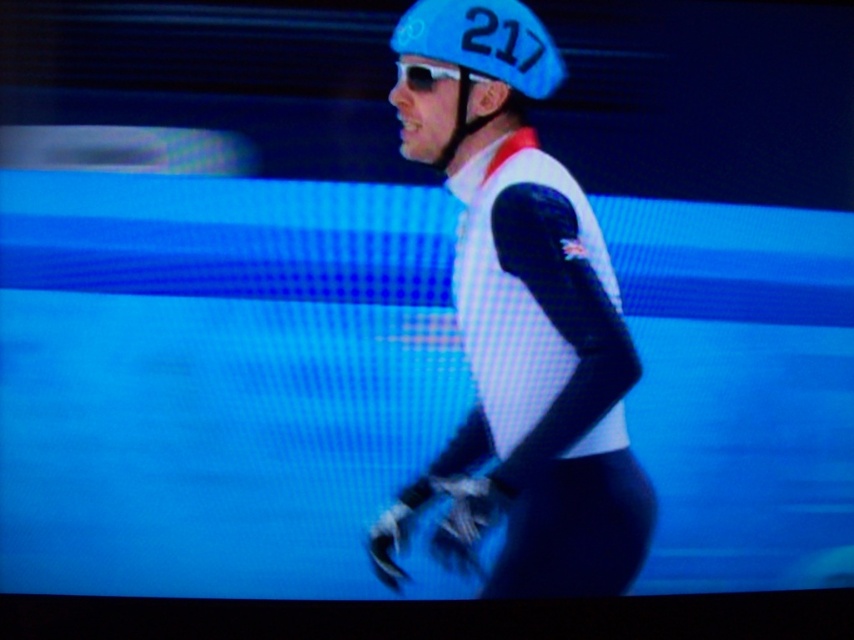
Question: Can you confirm if matte black suit at center is bigger than sunglasses at center?

Choices:
 (A) yes
 (B) no

Answer: (A)

Question: Which point is farther to the camera?

Choices:
 (A) (427, 84)
 (B) (535, 577)

Answer: (B)

Question: Can you confirm if matte black suit at center is positioned above blue matte helmet at upper center?

Choices:
 (A) no
 (B) yes

Answer: (A)

Question: Which of these objects is positioned farthest from the blue matte helmet at upper center?

Choices:
 (A) matte black suit at center
 (B) sunglasses at center

Answer: (A)

Question: Estimate the real-world distances between objects in this image. Which object is closer to the matte black suit at center?

Choices:
 (A) blue matte helmet at upper center
 (B) sunglasses at center

Answer: (A)

Question: Can you confirm if blue matte helmet at upper center is wider than sunglasses at center?

Choices:
 (A) yes
 (B) no

Answer: (A)